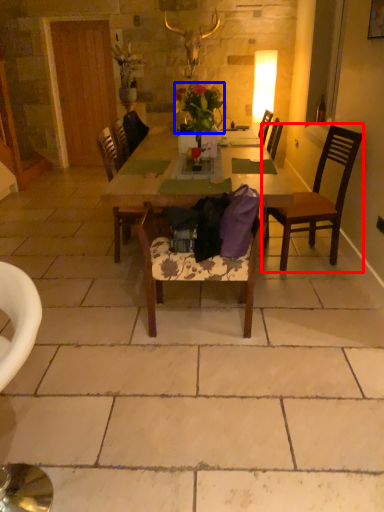
Question: Which of the following is the farthest to the observer, chair (highlighted by a red box) or flower (highlighted by a blue box)?

Choices:
 (A) chair
 (B) flower

Answer: (B)